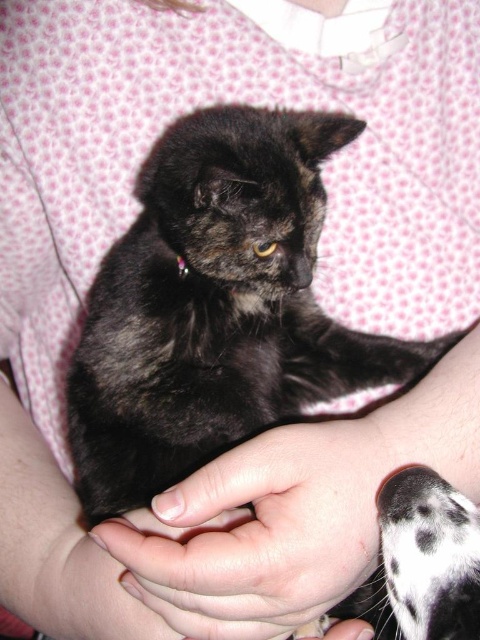
Is shiny black cat at center wider than black and white fur at lower right?

Yes, shiny black cat at center is wider than black and white fur at lower right.

How distant is shiny black cat at center from black and white fur at lower right?

11.24 inches

Who is more forward, (71, 369) or (447, 624)?

Point (447, 624)

The width and height of the screenshot is (480, 640). I want to click on shiny black cat at center, so click(216, 307).

Between point (204, 461) and point (286, 515), which one is positioned behind?

The point (204, 461) is more distant.

At what (x,y) coordinates should I click in order to perform the action: click on shiny black cat at center. Please return your answer as a coordinate pair (x, y). The height and width of the screenshot is (640, 480). Looking at the image, I should click on (216, 307).

Consider the image. Does smooth skin hand at center appear under black and white fur at lower right?

Incorrect, smooth skin hand at center is not positioned below black and white fur at lower right.

Is smooth skin hand at center further to the viewer compared to black and white fur at lower right?

Yes, it is behind black and white fur at lower right.

The height and width of the screenshot is (640, 480). What are the coordinates of `smooth skin hand at center` in the screenshot? It's located at (264, 532).